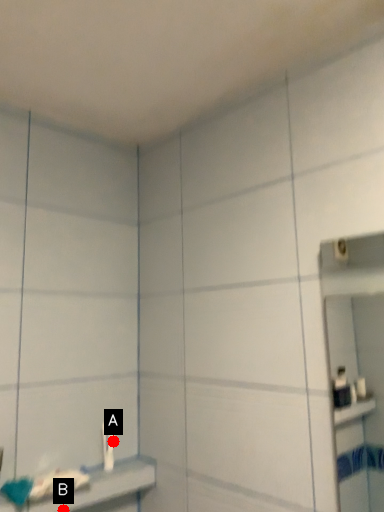
Question: Two points are circled on the image, labeled by A and B beside each circle. Which of the following is the farthest from the observer?

Choices:
 (A) A is further
 (B) B is further

Answer: (A)